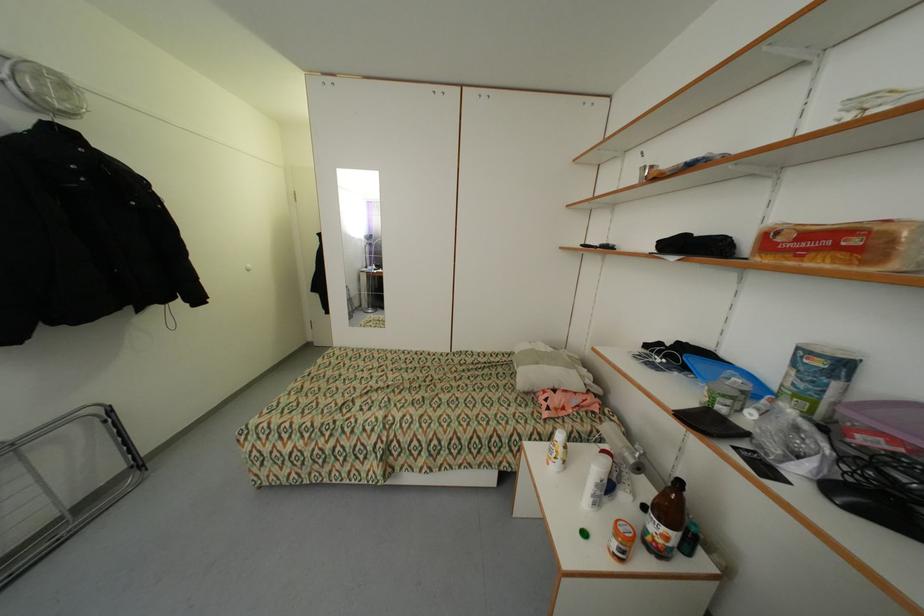
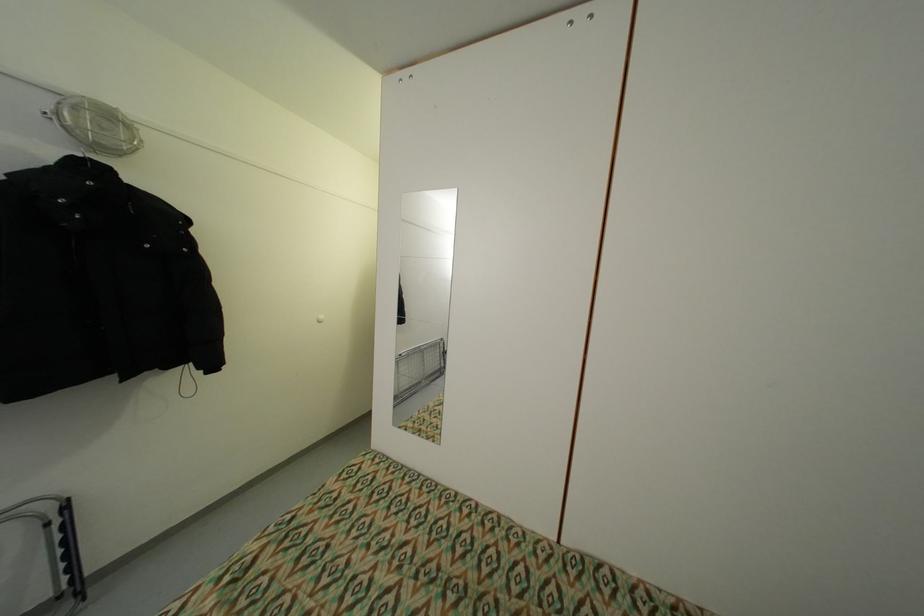
Question: In a continuous first-person perspective shot, in which direction is the camera moving?

Choices:
 (A) Left
 (B) Right
 (C) Forward
 (D) Backward

Answer: (C)